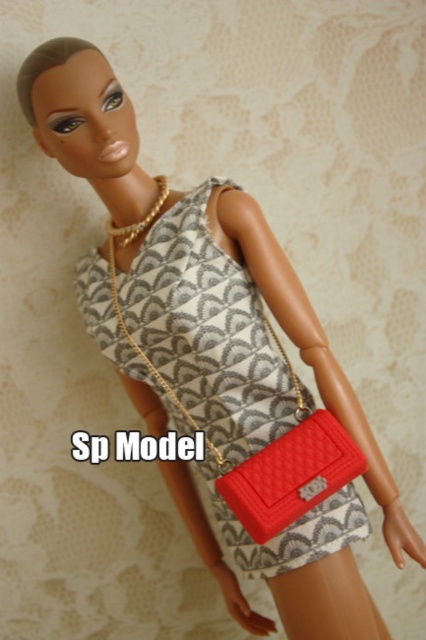
Question: From the image, what is the correct spatial relationship of quilted fabric dress at center in relation to matte red clutch at lower right?

Choices:
 (A) below
 (B) above

Answer: (B)

Question: Which point is closer to the camera taking this photo?

Choices:
 (A) (167, 374)
 (B) (345, 476)

Answer: (B)

Question: Observing the image, what is the correct spatial positioning of quilted fabric dress at center in reference to matte red clutch at lower right?

Choices:
 (A) above
 (B) below

Answer: (A)

Question: Which point is farther from the camera taking this photo?

Choices:
 (A) (141, 284)
 (B) (304, 483)

Answer: (A)

Question: Does quilted fabric dress at center lie behind matte red clutch at lower right?

Choices:
 (A) yes
 (B) no

Answer: (A)